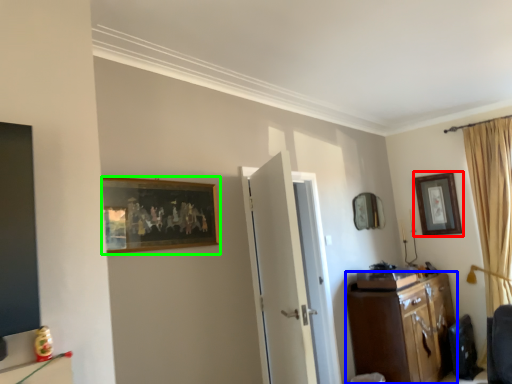
Question: Which object is the farthest from picture frame (highlighted by a red box)? Choose among these: cabinetry (highlighted by a blue box) or picture frame (highlighted by a green box).

Choices:
 (A) cabinetry
 (B) picture frame

Answer: (B)